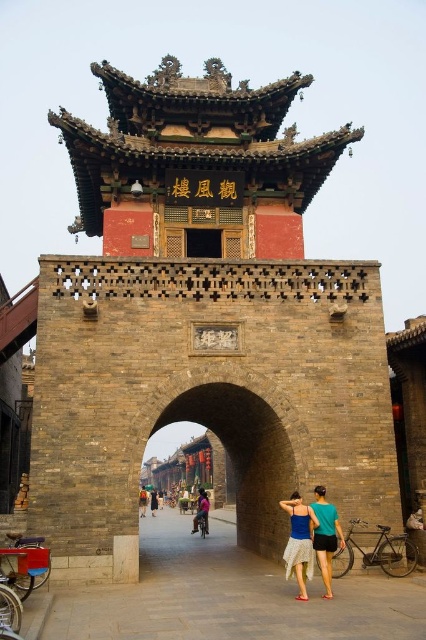
You are a visitor standing in front of the gatehouse and see both the blue denim skirt at center and the dark brown leather jacket at center. Which item is closer to you?

The blue denim skirt at center is closer to you because it is in front of the dark brown leather jacket at center.

You are a tour guide leading a group through a historical site. You notice a blue denim skirt at center and a pink fabric dress at center in the courtyard. Your group wants to know if they can walk directly between these two items without needing to detour. Can they?

The distance between the blue denim skirt at center and the pink fabric dress at center is 122.35 feet, so there is sufficient space for visitors to walk directly between them without needing to detour.